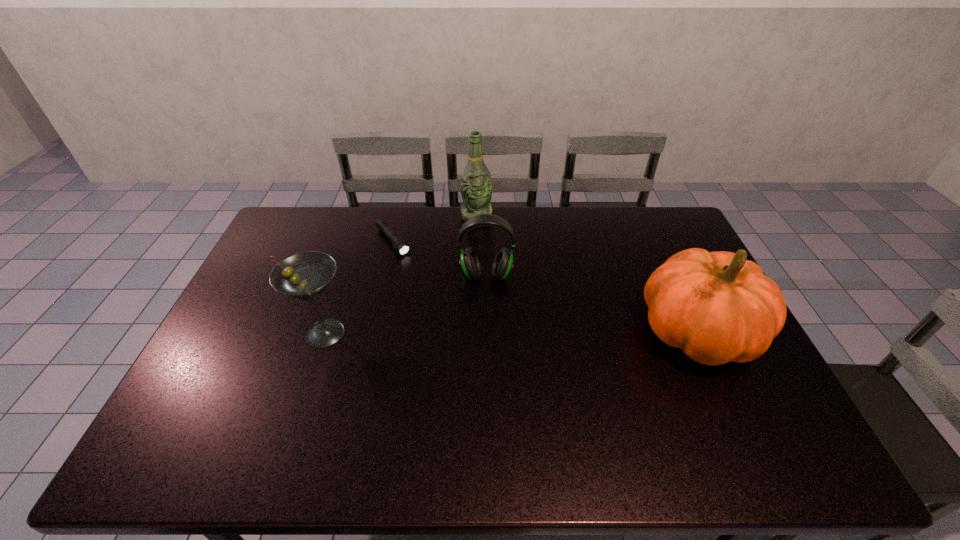
I want to click on free spot on the desktop that is between the martini and the rightmost object and is positioned on the ear cups of the third nearest object, so click(484, 333).

You are a GUI agent. You are given a task and a screenshot of the screen. Output one action in this format:
    pyautogui.click(x=<x>, y=<y>)
    Task: Click on the vacant space on the desktop that is between the martini and the rightmost object and is positioned at the lens end of the flashlight
    
    Given the screenshot: What is the action you would take?
    pyautogui.click(x=472, y=333)

In order to click on free space on the desktop that is between the martini and the pumpkin and is positioned on the surface of the beer bottle in this screenshot , I will do `click(506, 333)`.